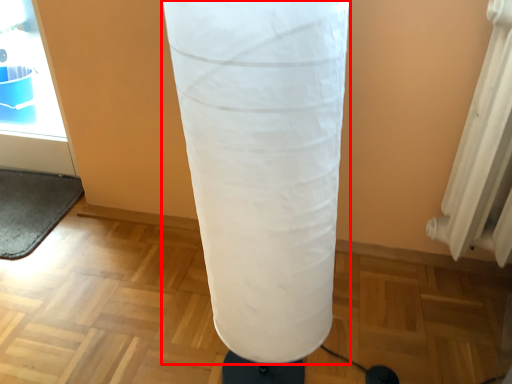
Question: From the image, what is the correct spatial relationship of punching bag (annotated by the red box) in relation to yoga mat?

Choices:
 (A) right
 (B) left

Answer: (A)